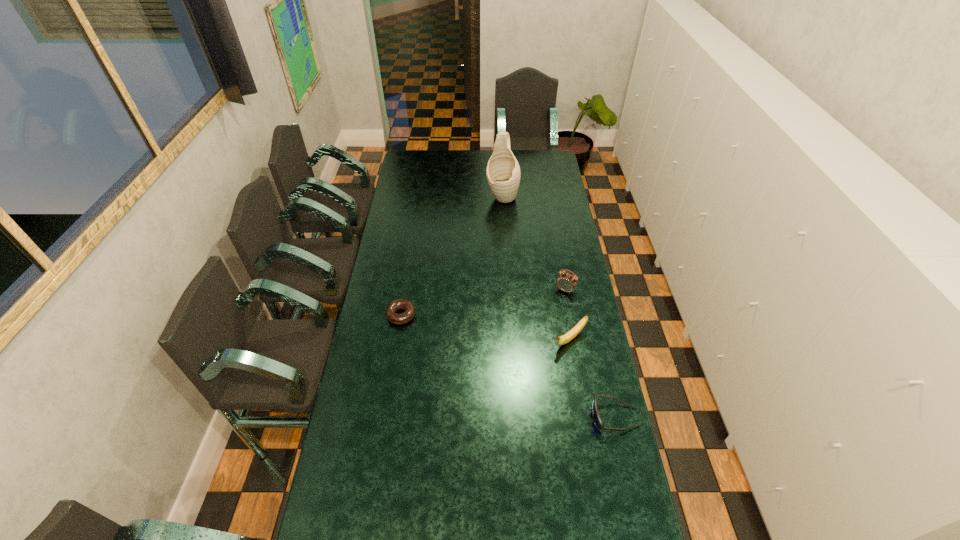
Locate an element on the screen. doughnut is located at coordinates (408, 306).

This screenshot has height=540, width=960. I want to click on the leftmost object, so click(408, 306).

Locate an element on the screen. The height and width of the screenshot is (540, 960). sunglasses is located at coordinates (596, 417).

You are a GUI agent. You are given a task and a screenshot of the screen. Output one action in this format:
    pyautogui.click(x=<x>, y=<y>)
    Task: Click on the second shortest object
    
    Given the screenshot: What is the action you would take?
    pyautogui.click(x=596, y=417)

Locate an element on the screen. the second tallest object is located at coordinates (567, 282).

Find the location of a particular element. This screenshot has width=960, height=540. the fourth nearest object is located at coordinates (567, 282).

Find the location of a particular element. The image size is (960, 540). the fourth object from right to left is located at coordinates (503, 172).

The height and width of the screenshot is (540, 960). I want to click on the tallest object, so (x=503, y=172).

Find the location of a particular element. The image size is (960, 540). banana is located at coordinates (564, 339).

Find the location of `the fourth farthest object`. the fourth farthest object is located at coordinates (564, 339).